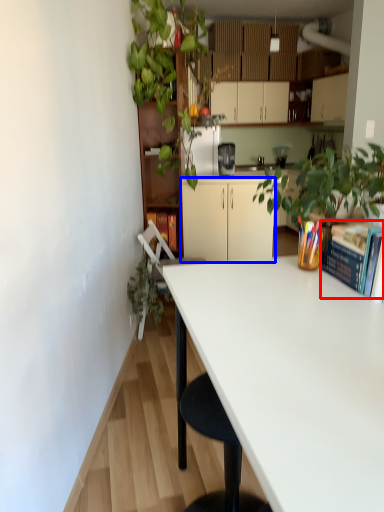
Question: Which object appears farthest to the camera in this image, paperback book (highlighted by a red box) or cabinetry (highlighted by a blue box)?

Choices:
 (A) paperback book
 (B) cabinetry

Answer: (B)